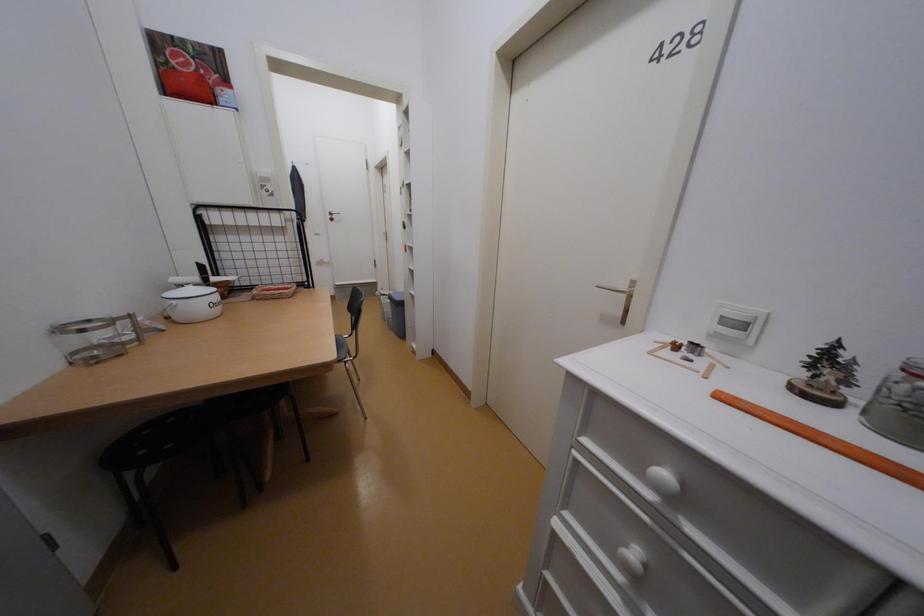
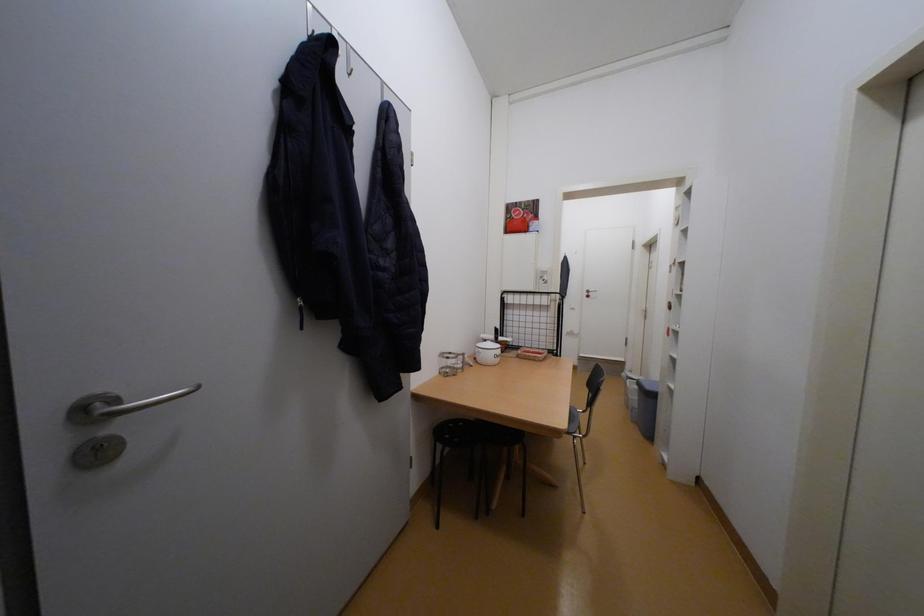
Question: The camera is either moving clockwise (left) or counter-clockwise (right) around the object. The first image is from the beginning of the video and the second image is from the end. Is the camera moving left or right when shooting the video?

Choices:
 (A) Left
 (B) Right

Answer: (B)